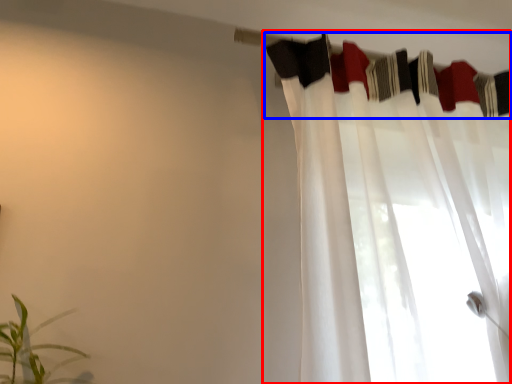
Question: Which point is further to the camera, curtain (highlighted by a red box) or clothesline (highlighted by a blue box)?

Choices:
 (A) curtain
 (B) clothesline

Answer: (B)